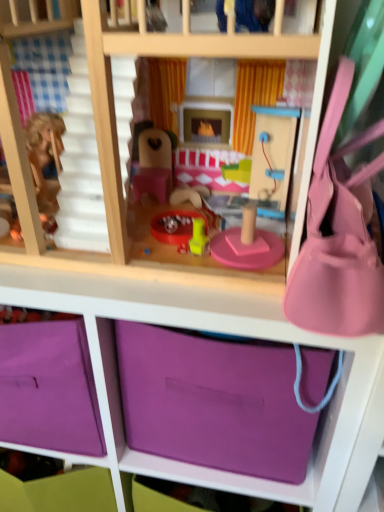
Where is `purple matte storage box at lower center`? purple matte storage box at lower center is located at coordinates (213, 401).

The height and width of the screenshot is (512, 384). What do you see at coordinates (337, 237) in the screenshot?
I see `pink fabric purse at right` at bounding box center [337, 237].

The height and width of the screenshot is (512, 384). I want to click on pink wood bunk bed at center, so click(x=190, y=55).

Is purple matte storage box at lower center bigger than purple fabric storage at center?

Actually, purple matte storage box at lower center might be smaller than purple fabric storage at center.

Which point is more distant from viewer, (161, 359) or (120, 278)?

The point (161, 359) is farther from the camera.

Is purple matte storage box at lower center far away from purple fabric storage at center?

No, purple matte storage box at lower center is in close proximity to purple fabric storage at center.

Considering the relative positions of pink fabric purse at right and pink wood bunk bed at center in the image provided, is pink fabric purse at right to the right of pink wood bunk bed at center from the viewer's perspective?

Indeed, pink fabric purse at right is positioned on the right side of pink wood bunk bed at center.

Considering the sizes of objects pink fabric purse at right and pink wood bunk bed at center in the image provided, who is wider, pink fabric purse at right or pink wood bunk bed at center?

pink wood bunk bed at center is wider.

Considering the sizes of objects pink fabric purse at right and pink wood bunk bed at center in the image provided, who is bigger, pink fabric purse at right or pink wood bunk bed at center?

Bigger between the two is pink wood bunk bed at center.

From a real-world perspective, is pink fabric purse at right under pink wood bunk bed at center?

Correct, in the physical world, pink fabric purse at right is lower than pink wood bunk bed at center.

Considering the sizes of objects purple matte storage box at lower center and pink fabric purse at right in the image provided, who is thinner, purple matte storage box at lower center or pink fabric purse at right?

pink fabric purse at right is thinner.

Who is taller, purple matte storage box at lower center or pink fabric purse at right?

purple matte storage box at lower center is taller.

From the picture: Does purple matte storage box at lower center have a smaller size compared to pink fabric purse at right?

Incorrect, purple matte storage box at lower center is not smaller in size than pink fabric purse at right.

Is purple matte storage box at lower center facing towards pink fabric purse at right?

No, purple matte storage box at lower center is not facing towards pink fabric purse at right.

From the picture: From the image's perspective, is pink fabric purse at right over purple fabric storage at center?

Yes.

Is pink fabric purse at right looking in the opposite direction of purple fabric storage at center?

No, pink fabric purse at right is not facing the opposite direction of purple fabric storage at center.

Which is in front, point (315, 275) or point (245, 480)?

Point (315, 275)

From a real-world perspective, which object stands above the other?

From a 3D spatial view, pink fabric purse at right is above.

Considering the sizes of purple fabric storage at center and pink wood bunk bed at center in the image, is purple fabric storage at center wider or thinner than pink wood bunk bed at center?

In the image, purple fabric storage at center appears to be wider than pink wood bunk bed at center.

Is purple fabric storage at center to the left or to the right of pink wood bunk bed at center in the image?

In the image, purple fabric storage at center appears on the right side of pink wood bunk bed at center.

Considering the positions of point (214, 473) and point (182, 51), is point (214, 473) closer or farther from the camera than point (182, 51)?

Point (214, 473) appears to be farther away from the viewer than point (182, 51).

Could pink wood bunk bed at center be considered to be inside purple fabric storage at center?

No, purple fabric storage at center does not contain pink wood bunk bed at center.

Is pink wood bunk bed at center surrounded by purple matte storage box at lower center?

No, pink wood bunk bed at center is not a part of purple matte storage box at lower center.

Can you confirm if purple matte storage box at lower center is thinner than pink wood bunk bed at center?

Indeed, purple matte storage box at lower center has a lesser width compared to pink wood bunk bed at center.

Does purple matte storage box at lower center have a lesser height compared to pink wood bunk bed at center?

Yes.

Can you confirm if purple matte storage box at lower center is smaller than pink wood bunk bed at center?

Yes, purple matte storage box at lower center is smaller than pink wood bunk bed at center.

Considering the relative positions of purple fabric storage at center and purple matte storage box at lower center in the image provided, is purple fabric storage at center to the left of purple matte storage box at lower center from the viewer's perspective?

Indeed, purple fabric storage at center is positioned on the left side of purple matte storage box at lower center.

Would you say purple fabric storage at center is outside purple matte storage box at lower center?

Yes, purple fabric storage at center is located beyond the bounds of purple matte storage box at lower center.

Between point (87, 316) and point (126, 340), which one is positioned behind?

Point (126, 340)

Does purple fabric storage at center have a lesser width compared to purple matte storage box at lower center?

No.

Identify the location of shelf in front of the purple matte storage box at lower center. (227, 332).

I want to click on bunk bed behind the pink fabric purse at right, so click(x=190, y=55).

Consider the image. Based on their spatial positions, is pink wood bunk bed at center or purple matte storage box at lower center closer to pink fabric purse at right?

pink wood bunk bed at center lies closer to pink fabric purse at right than the other object.

Based on the photo, based on their spatial positions, is purple matte storage box at lower center or pink fabric purse at right further from pink wood bunk bed at center?

purple matte storage box at lower center lies further to pink wood bunk bed at center than the other object.

Looking at the image, which one is located further to pink fabric purse at right, purple fabric storage at center or purple matte storage box at lower center?

purple matte storage box at lower center is further to pink fabric purse at right.

Estimate the real-world distances between objects in this image. Which object is further from pink wood bunk bed at center, pink fabric purse at right or purple matte storage box at lower center?

The object further to pink wood bunk bed at center is purple matte storage box at lower center.

Looking at the image, which one is located closer to pink fabric purse at right, purple fabric storage at center or pink wood bunk bed at center?

The object closer to pink fabric purse at right is pink wood bunk bed at center.

From the image, which object appears to be farther from purple fabric storage at center, pink fabric purse at right or purple matte storage box at lower center?

pink fabric purse at right lies further to purple fabric storage at center than the other object.

From the image, which object appears to be farther from purple fabric storage at center, purple matte storage box at lower center or pink fabric purse at right?

pink fabric purse at right lies further to purple fabric storage at center than the other object.

When comparing their distances from pink fabric purse at right, does purple matte storage box at lower center or pink wood bunk bed at center seem further?

The object further to pink fabric purse at right is purple matte storage box at lower center.

Identify the location of accessory between pink wood bunk bed at center and purple fabric storage at center in the up-down direction. (337, 237).

Where is `storage box between pink wood bunk bed at center and purple fabric storage at center vertically`? The image size is (384, 512). storage box between pink wood bunk bed at center and purple fabric storage at center vertically is located at coordinates (213, 401).

Image resolution: width=384 pixels, height=512 pixels. I want to click on storage box that lies between pink fabric purse at right and purple fabric storage at center from top to bottom, so click(213, 401).

The image size is (384, 512). In order to click on accessory between pink wood bunk bed at center and purple matte storage box at lower center in the up-down direction in this screenshot , I will do `click(337, 237)`.